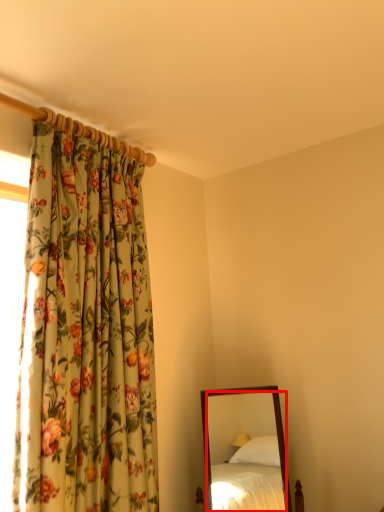
Question: From the image's perspective, what is the correct spatial positioning of mirror (annotated by the red box) in reference to curtain?

Choices:
 (A) below
 (B) above

Answer: (A)